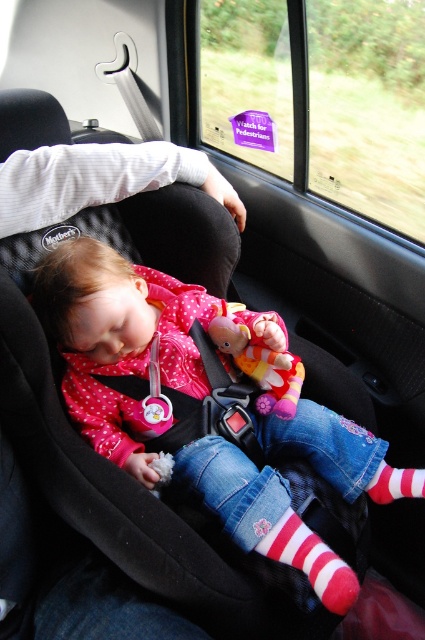
You are a parent checking on your child in the car. You notice the white fabric at upper left and the striped cotton sock at lower right. Which object is positioned higher in the car seat area?

The white fabric at upper left is located above the striped cotton sock at lower right, so it is positioned higher in the car seat area.

You are a parent driving your child home. You want to check if the white fabric at upper left is within reach of your child in the black car seat. The child can reach 3 feet. Can they reach it?

The white fabric at upper left is 3.57 feet away from the child in the black car seat, which is beyond the child can reach 3 feet. So the child cannot reach it.